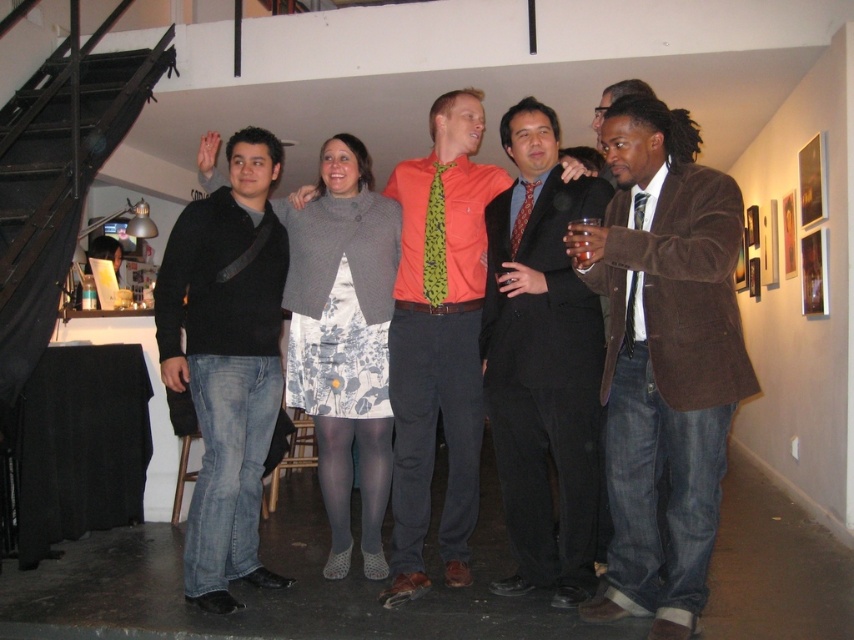
Is point (564, 412) more distant than point (410, 196)?

No, it is not.

Can you confirm if matte black suit at center is positioned to the right of orange cotton shirt at center?

Indeed, matte black suit at center is positioned on the right side of orange cotton shirt at center.

Who is more forward, (539, 273) or (463, 413)?

Point (539, 273) is in front.

At what (x,y) coordinates should I click in order to perform the action: click on matte black suit at center. Please return your answer as a coordinate pair (x, y). Looking at the image, I should click on (542, 365).

Does brown corduroy blazer at right have a smaller size compared to green leafy fabric tie at center?

Incorrect, brown corduroy blazer at right is not smaller in size than green leafy fabric tie at center.

Between brown corduroy blazer at right and green leafy fabric tie at center, which one appears on the left side from the viewer's perspective?

From the viewer's perspective, green leafy fabric tie at center appears more on the left side.

Which is behind, point (636, 385) or point (442, 250)?

Positioned behind is point (442, 250).

This screenshot has height=640, width=854. In order to click on brown corduroy blazer at right in this screenshot , I will do `click(664, 362)`.

Does point (243, 301) lie behind point (436, 305)?

That is True.

Is the position of black matte sweater at left less distant than that of green leafy fabric tie at center?

Yes, black matte sweater at left is closer to the viewer.

Between point (267, 449) and point (431, 200), which one is positioned in front?

Point (431, 200)

Locate an element on the screen. black matte sweater at left is located at coordinates (226, 360).